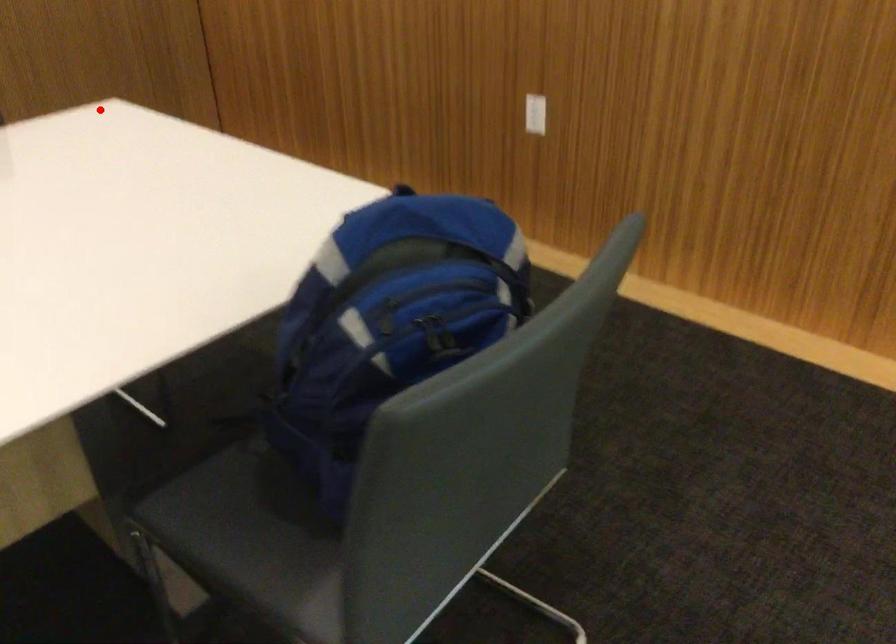
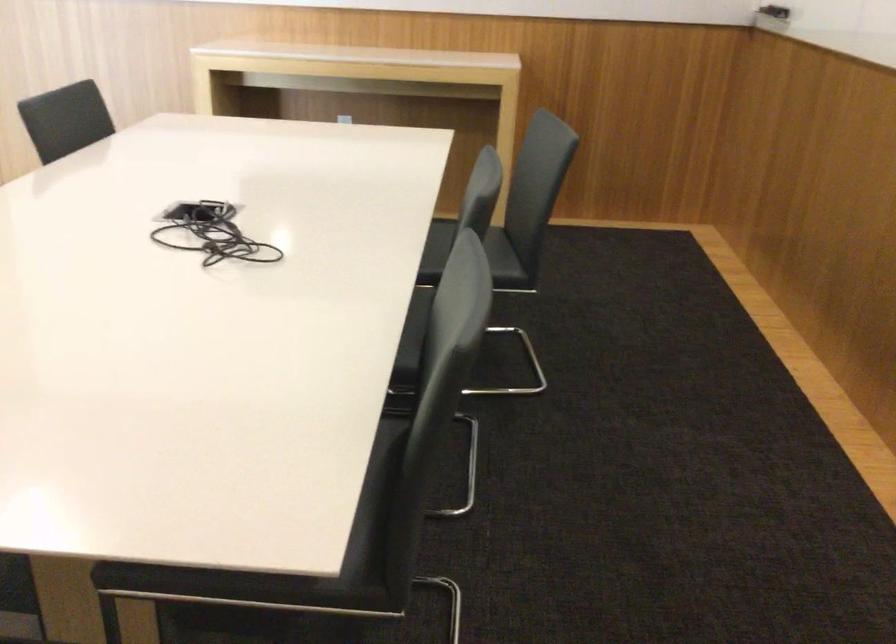
The point at the highlighted location is marked in the first image. Where is the corresponding point in the second image?

(311, 558)